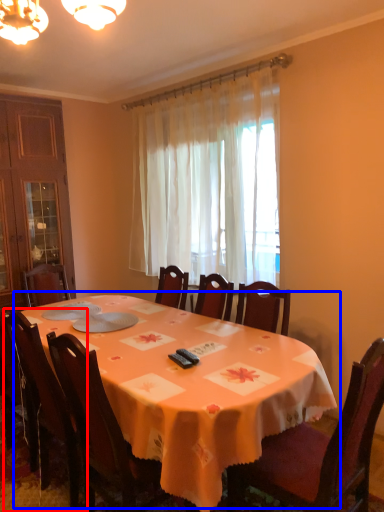
Question: Which point is closer to the camera, chair (highlighted by a red box) or table (highlighted by a blue box)?

Choices:
 (A) chair
 (B) table

Answer: (B)